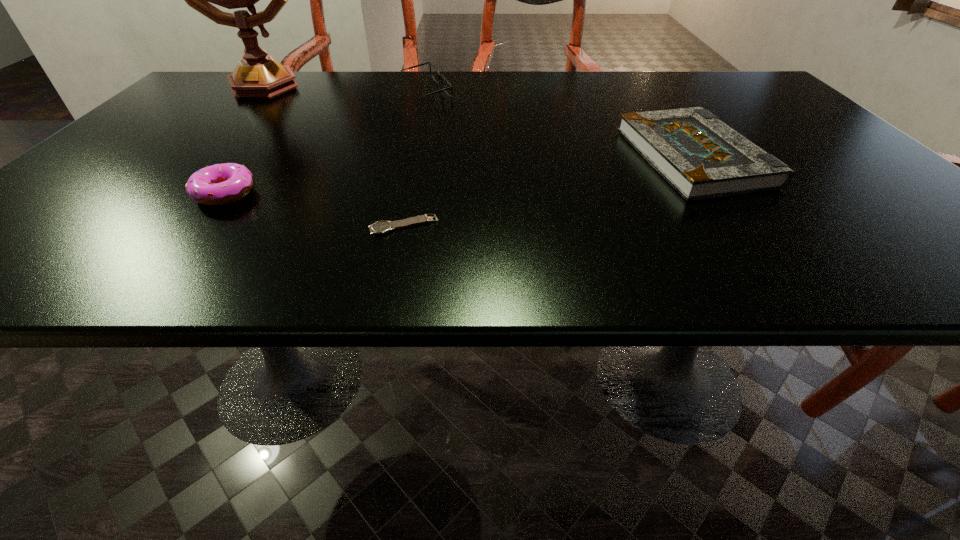
Identify the location of vacant area that lies between the doughnut and the watch. The image size is (960, 540). (314, 209).

Identify the location of vacant area that lies between the nearest object and the globe. The width and height of the screenshot is (960, 540). (331, 155).

Identify which object is the fourth closest to the watch. Please provide its 2D coordinates. Your answer should be formatted as a tuple, i.e. [(x, y)], where the tuple contains the x and y coordinates of a point satisfying the conditions above.

[(257, 75)]

Identify the location of object that is the second nearest to the doughnut. The height and width of the screenshot is (540, 960). (257, 75).

What are the coordinates of `free point that satisfies the following two spatial constraints: 1. with the lenses facing outward on the fourth shortest object; 2. on the right side of the notebook` in the screenshot? It's located at (410, 158).

Locate an element on the screen. Image resolution: width=960 pixels, height=540 pixels. vacant point that satisfies the following two spatial constraints: 1. on the front-facing side of the tallest object; 2. on the right side of the doughnut is located at coordinates (150, 193).

Where is `vacant space that satisfies the following two spatial constraints: 1. on the front-facing side of the nearest object; 2. on the left side of the globe`? vacant space that satisfies the following two spatial constraints: 1. on the front-facing side of the nearest object; 2. on the left side of the globe is located at coordinates point(118,225).

Locate an element on the screen. This screenshot has width=960, height=540. free space in the image that satisfies the following two spatial constraints: 1. on the front-facing side of the tallest object; 2. on the right side of the doughnut is located at coordinates (150, 193).

The image size is (960, 540). In order to click on vacant area that satisfies the following two spatial constraints: 1. on the back side of the notebook; 2. with the lenses facing outward on the fourth shortest object in this screenshot , I will do `click(646, 93)`.